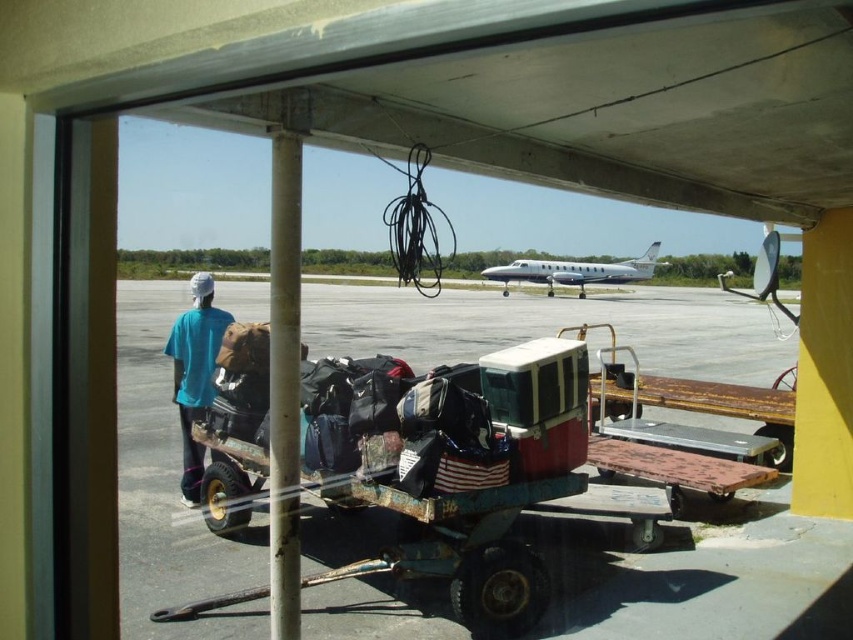
Question: Is rusty metal cart at center positioned at the back of white glossy airplane at center?

Choices:
 (A) yes
 (B) no

Answer: (B)

Question: Which is farther from the blue t-shirt at center?

Choices:
 (A) white glossy airplane at center
 (B) rusty metal cart at center

Answer: (A)

Question: Is blue t-shirt at center further to the viewer compared to white glossy airplane at center?

Choices:
 (A) yes
 (B) no

Answer: (B)

Question: Which is nearer to the rusty metal cart at center?

Choices:
 (A) white glossy airplane at center
 (B) blue t-shirt at center

Answer: (B)

Question: Is blue t-shirt at center positioned at the back of white glossy airplane at center?

Choices:
 (A) yes
 (B) no

Answer: (B)

Question: Estimate the real-world distances between objects in this image. Which object is closer to the blue t-shirt at center?

Choices:
 (A) white glossy airplane at center
 (B) rusty metal cart at center

Answer: (B)